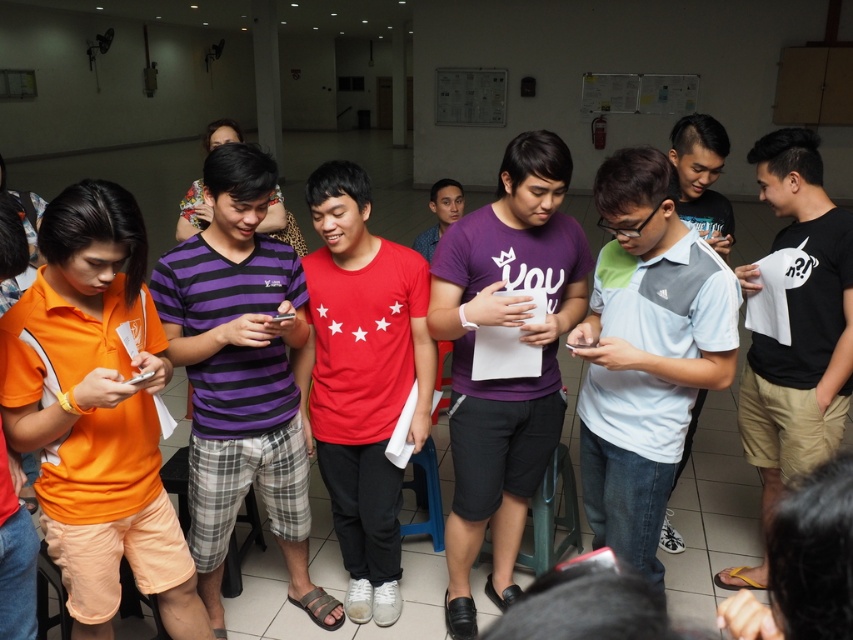
You are organizing a photo shoot and need to arrange two models wearing the purple striped shirt at center and the purple matte shirt at center. Based on their clothing sizes, which model should you place in the foreground to ensure both are visible in the frame?

The purple striped shirt at center has a smaller size compared to the purple matte shirt at center. To ensure both are visible, place the smaller purple striped shirt at center in the foreground so it appears larger in the frame, balancing its size with the larger purple matte shirt at center in the background.

You are standing in the corridor and want to hand a document to the person wearing the light blue and gray adidas polo shirt at center. If your arm can reach up to 1.5 meters, can you reach them without moving closer?

The distance between you and the light blue and gray adidas polo shirt at center is 1.74 meters, which is beyond your arm reach of 1.5 meters. Therefore, you cannot reach them without moving closer.